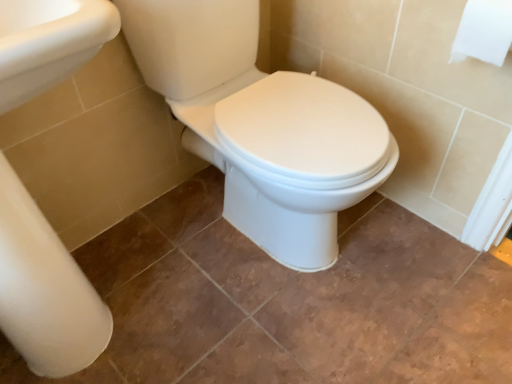
Question: From the image's perspective, does white glossy porcelain at center appear lower than white paper at upper right?

Choices:
 (A) no
 (B) yes

Answer: (B)

Question: Can you see white glossy porcelain at center touching white paper at upper right?

Choices:
 (A) yes
 (B) no

Answer: (B)

Question: Does white glossy porcelain at center have a larger size compared to white paper at upper right?

Choices:
 (A) yes
 (B) no

Answer: (A)

Question: Is white glossy porcelain at center facing away from white paper at upper right?

Choices:
 (A) yes
 (B) no

Answer: (B)

Question: Does white glossy porcelain at center have a greater height compared to white paper at upper right?

Choices:
 (A) yes
 (B) no

Answer: (A)

Question: From a real-world perspective, is white glossy porcelain at center on white paper at upper right?

Choices:
 (A) yes
 (B) no

Answer: (B)

Question: Is white paper at upper right in front of white glossy porcelain at center?

Choices:
 (A) no
 (B) yes

Answer: (A)

Question: Can you confirm if white paper at upper right is bigger than white glossy porcelain at center?

Choices:
 (A) yes
 (B) no

Answer: (B)

Question: Is white paper at upper right facing away from white glossy porcelain at center?

Choices:
 (A) yes
 (B) no

Answer: (B)

Question: Can you confirm if white paper at upper right is taller than white glossy porcelain at center?

Choices:
 (A) yes
 (B) no

Answer: (B)

Question: Can you confirm if white paper at upper right is positioned to the right of white glossy porcelain at center?

Choices:
 (A) yes
 (B) no

Answer: (A)

Question: From a real-world perspective, is white paper at upper right physically below white glossy porcelain at center?

Choices:
 (A) yes
 (B) no

Answer: (B)

Question: In the image, is white glossy porcelain at center positioned in front of or behind white paper at upper right?

Choices:
 (A) behind
 (B) front

Answer: (B)